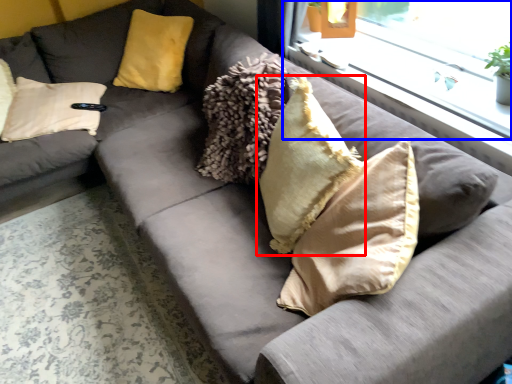
Question: Which point is closer to the camera, pillow (highlighted by a red box) or window (highlighted by a blue box)?

Choices:
 (A) pillow
 (B) window

Answer: (A)